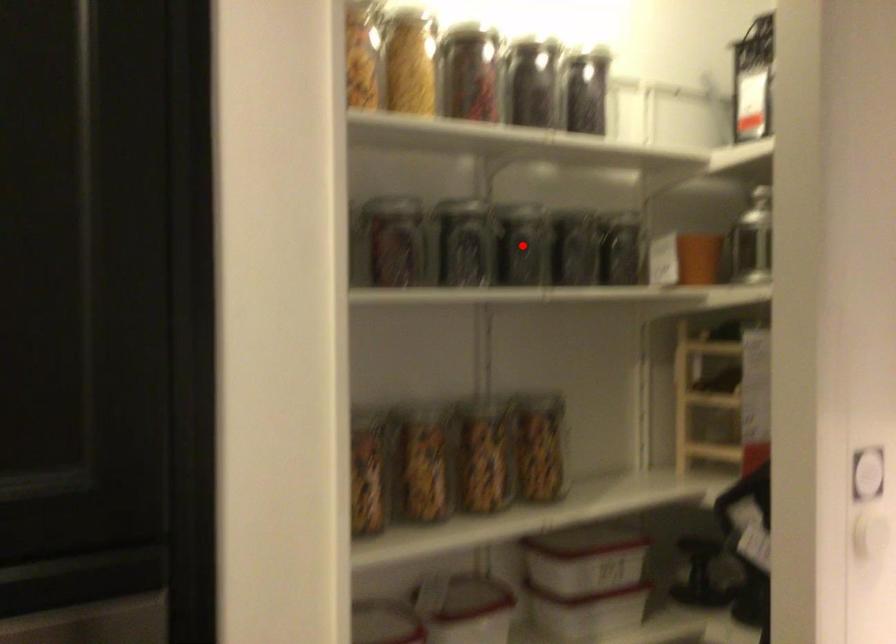
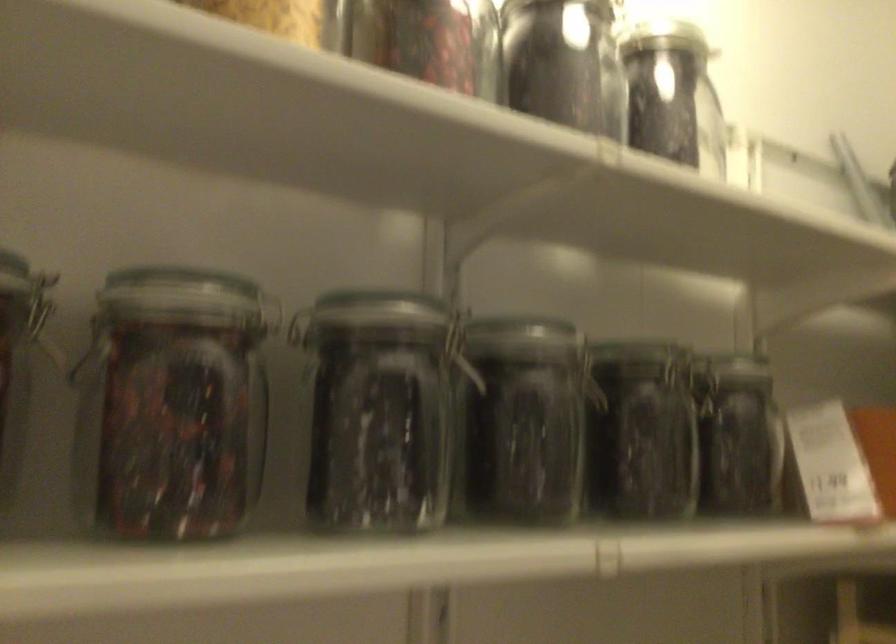
Question: I am providing you with two images of the same scene from different viewpoints. A red point is shown in image1. For the corresponding object point in image2, is it positioned nearer or farther from the camera?

Choices:
 (A) Nearer
 (B) Farther

Answer: (A)